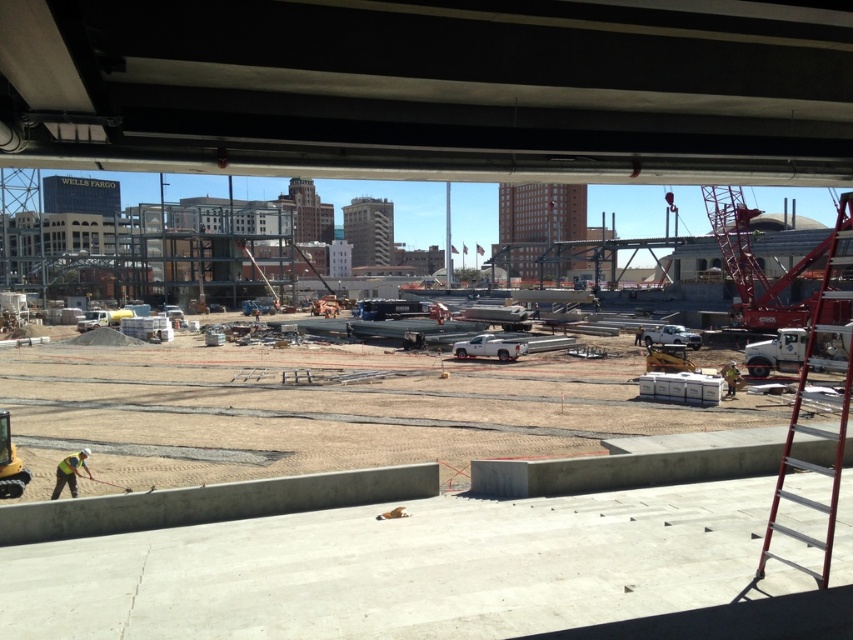
You are standing at the point labeled point (19,584) on a construction site. You want to take a photo of the entire construction site from your current position. Is the camera positioned at the camera able to capture the entire scene without moving?

The distance between point (19,584) and the camera is 10.65 meters. Since the camera is positioned 10.65 meters away from your location, it may not be able to capture the entire construction site from that distance without moving. You might need to adjust your position or use a wider lens to ensure the whole scene is included.

You are standing at the camera position and want to throw a tool to the concrete at center. Is the distance within a 5 meter range?

The concrete at center and camera are 5.22 meters apart, which is slightly beyond the 5 meter range. Therefore, the tool cannot be thrown within 5 meters.

You are a safety inspector standing at the yellow reflective vest at lower left. You need to reach the red metallic crane at upper right to check its safety. The safety protocol requires you to stay within a 40 meter radius of your starting point. Can you safely reach the crane without violating the protocol?

The red metallic crane at upper right is 37.55 meters away from the yellow reflective vest at lower left. Since 37.55 meters is within the 40 meter radius requirement, you can safely reach the crane without violating the protocol.